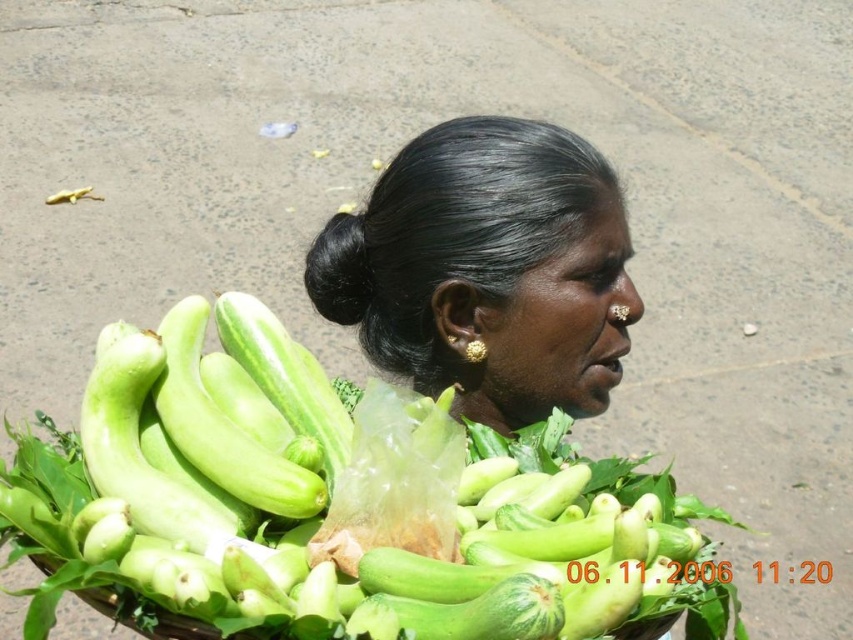
Looking at this image, the woman is holding a tool in her right hand. She wants to place it between the green smooth zucchini at center and the black shiny hair at center. Which side should she place it on to be between them?

The green smooth zucchini at center is to the left of the black shiny hair at center. Therefore, she should place the tool to the right of the zucchini and to the left of the hair to position it between them.

In the scene shown: You are a customer at the market and want to buy a green smooth zucchini. The vendor points to the exact location of the zucchini at point (305, 500). Where should you look to find the green smooth zucchini?

The green smooth zucchini is located at the center at point (305, 500).

You are a customer at the market and want to buy the green smooth zucchini at center. If your hand is 12 inches long, can you reach the zucchini from where you are standing?

The green smooth zucchini at center is 24.33 inches away from you. Since your hand is only 12 inches long, you cannot reach it with your current position.